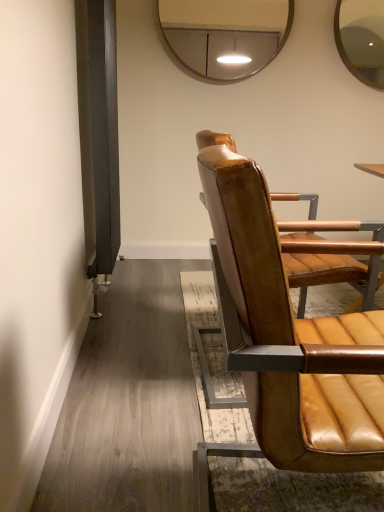
I want to click on metallic silver mirror at upper center, so click(x=225, y=35).

The width and height of the screenshot is (384, 512). Describe the element at coordinates (225, 35) in the screenshot. I see `metallic silver mirror at upper center` at that location.

Measure the distance between metallic silver mirror at upper center and camera.

metallic silver mirror at upper center is 7.90 feet away from camera.

Measure the distance between point (x=242, y=67) and camera.

Point (x=242, y=67) and camera are 8.69 feet apart from each other.

What do you see at coordinates (290, 332) in the screenshot?
I see `leather seat at right` at bounding box center [290, 332].

At what (x,y) coordinates should I click in order to perform the action: click on leather seat at right. Please return your answer as a coordinate pair (x, y). Looking at the image, I should click on (290, 332).

Locate an element on the screen. metallic silver mirror at upper center is located at coordinates (225, 35).

Between leather seat at right and metallic silver mirror at upper center, which one appears on the left side from the viewer's perspective?

Positioned to the left is metallic silver mirror at upper center.

Is leather seat at right further to camera compared to metallic silver mirror at upper center?

No, leather seat at right is closer to the camera.

Which is behind, point (280, 307) or point (178, 38)?

The point (178, 38) is behind.

From the image's perspective, does leather seat at right appear lower than metallic silver mirror at upper center?

Indeed, from the image's perspective, leather seat at right is shown beneath metallic silver mirror at upper center.

From a real-world perspective, which is physically below, leather seat at right or metallic silver mirror at upper center?

In real-world perspective, leather seat at right is lower.

Can you confirm if leather seat at right is thinner than metallic silver mirror at upper center?

No.

From their relative heights in the image, would you say leather seat at right is taller or shorter than metallic silver mirror at upper center?

In the image, leather seat at right appears to be taller than metallic silver mirror at upper center.

Considering the sizes of leather seat at right and metallic silver mirror at upper center in the image, is leather seat at right bigger or smaller than metallic silver mirror at upper center?

In the image, leather seat at right appears to be larger than metallic silver mirror at upper center.

Would you say leather seat at right is inside or outside metallic silver mirror at upper center?

leather seat at right is located beyond the bounds of metallic silver mirror at upper center.

Is leather seat at right next to metallic silver mirror at upper center and touching it?

There is a gap between leather seat at right and metallic silver mirror at upper center.

Is leather seat at right oriented away from metallic silver mirror at upper center?

No, leather seat at right's orientation is not away from metallic silver mirror at upper center.

Consider the image. How distant is leather seat at right from metallic silver mirror at upper center?

They are 1.94 meters apart.

Where is `mirror located behind the leather seat at right`? Image resolution: width=384 pixels, height=512 pixels. mirror located behind the leather seat at right is located at coordinates (225, 35).

Between metallic silver mirror at upper center and leather seat at right, which one appears on the right side from the viewer's perspective?

leather seat at right is more to the right.

Which object is further away from the camera taking this photo, metallic silver mirror at upper center or leather seat at right?

metallic silver mirror at upper center is further away from the camera.

Does point (202, 10) lie behind point (234, 288)?

Yes, it is.

From the image's perspective, is metallic silver mirror at upper center located above leather seat at right?

Yes, from the image's perspective, metallic silver mirror at upper center is on top of leather seat at right.

From a real-world perspective, is metallic silver mirror at upper center positioned over leather seat at right based on gravity?

Yes, from a real-world perspective, metallic silver mirror at upper center is on top of leather seat at right.

Does metallic silver mirror at upper center have a lesser width compared to leather seat at right?

Correct, the width of metallic silver mirror at upper center is less than that of leather seat at right.

Considering the sizes of metallic silver mirror at upper center and leather seat at right in the image, is metallic silver mirror at upper center taller or shorter than leather seat at right?

Clearly, metallic silver mirror at upper center is shorter compared to leather seat at right.

Looking at the image, does metallic silver mirror at upper center seem bigger or smaller compared to leather seat at right?

In the image, metallic silver mirror at upper center appears to be smaller than leather seat at right.

Based on the photo, is leather seat at right surrounded by metallic silver mirror at upper center?

No, leather seat at right is not surrounded by metallic silver mirror at upper center.

Based on the photo, is metallic silver mirror at upper center with leather seat at right?

metallic silver mirror at upper center and leather seat at right are clearly separated.

Is metallic silver mirror at upper center aimed at leather seat at right?

No, metallic silver mirror at upper center is not turned towards leather seat at right.

Can you tell me how much metallic silver mirror at upper center and leather seat at right differ in facing direction?

There is a 86.4-degree angle between the facing directions of metallic silver mirror at upper center and leather seat at right.

How far apart are metallic silver mirror at upper center and leather seat at right?

1.94 meters.

You are a GUI agent. You are given a task and a screenshot of the screen. Output one action in this format:
    pyautogui.click(x=<x>, y=<y>)
    Task: Click on the mirror behind the leather seat at right
    
    Given the screenshot: What is the action you would take?
    pyautogui.click(x=225, y=35)

The height and width of the screenshot is (512, 384). In order to click on mirror that appears above the leather seat at right (from the image's perspective) in this screenshot , I will do pos(225,35).

Identify the location of mirror behind the leather seat at right. Image resolution: width=384 pixels, height=512 pixels. (225, 35).